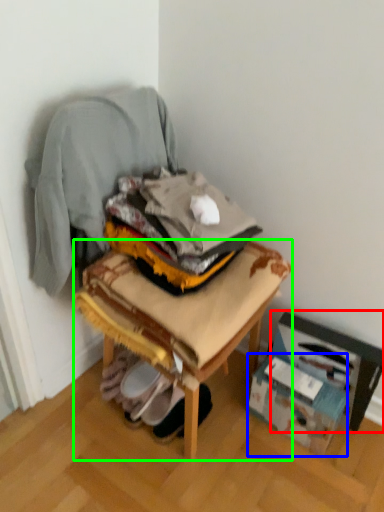
Question: Considering the real-world distances, which object is farthest from cardboard box (highlighted by a red box)? cardboard box (highlighted by a blue box) or furniture (highlighted by a green box)?

Choices:
 (A) cardboard box
 (B) furniture

Answer: (B)